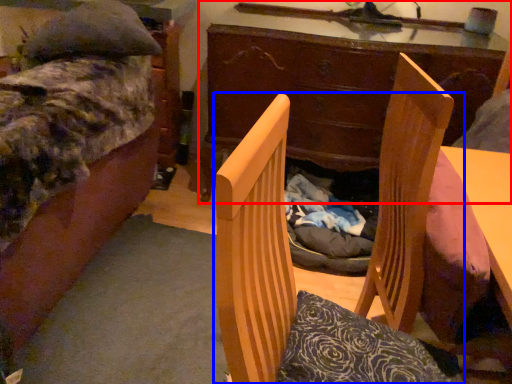
Question: Among these objects, which one is nearest to the camera, desk (highlighted by a red box) or chair (highlighted by a blue box)?

Choices:
 (A) desk
 (B) chair

Answer: (B)